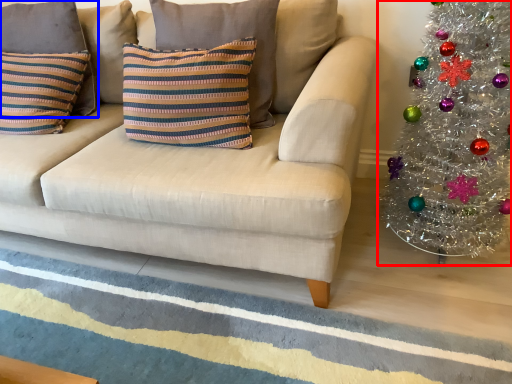
Question: Which object appears farthest to the camera in this image, christmas tree (highlighted by a red box) or pillow (highlighted by a blue box)?

Choices:
 (A) christmas tree
 (B) pillow

Answer: (B)